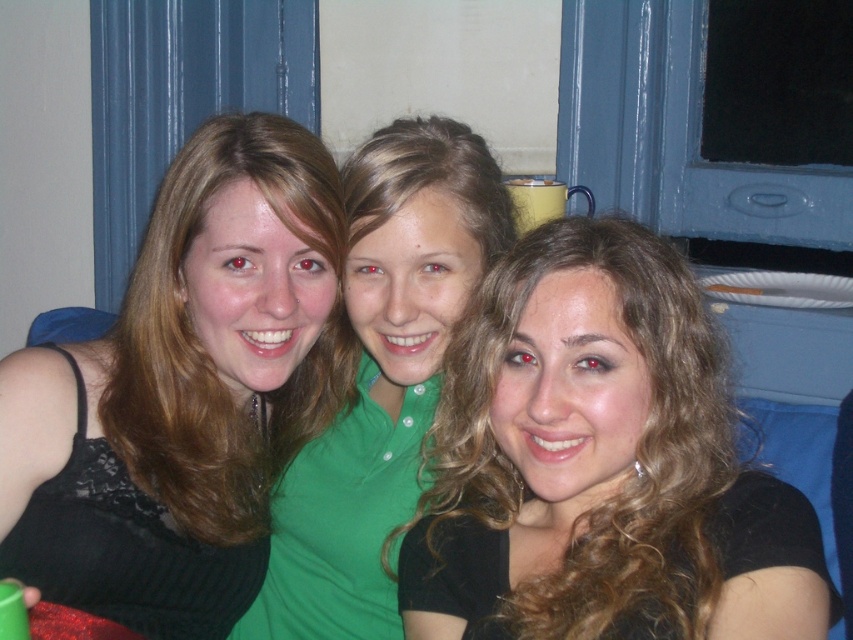
Is black matte hair at center wider than green matte shirt at center?

Yes.

Where is `black matte hair at center`? This screenshot has width=853, height=640. black matte hair at center is located at coordinates (590, 454).

Locate an element on the screen. Image resolution: width=853 pixels, height=640 pixels. black matte hair at center is located at coordinates click(x=590, y=454).

In the scene shown: Does matte black tank top at left appear on the right side of green matte shirt at center?

No, matte black tank top at left is not to the right of green matte shirt at center.

This screenshot has height=640, width=853. In order to click on matte black tank top at left in this screenshot , I will do `click(183, 392)`.

Locate an element on the screen. Image resolution: width=853 pixels, height=640 pixels. matte black tank top at left is located at coordinates pyautogui.click(x=183, y=392).

Is point (245, 193) positioned in front of point (569, 392)?

No.

Is matte black tank top at left positioned at the back of black matte hair at center?

Yes, it is.

Between point (167, 300) and point (735, 515), which one is positioned behind?

Point (167, 300)

Locate an element on the screen. The height and width of the screenshot is (640, 853). matte black tank top at left is located at coordinates (183, 392).